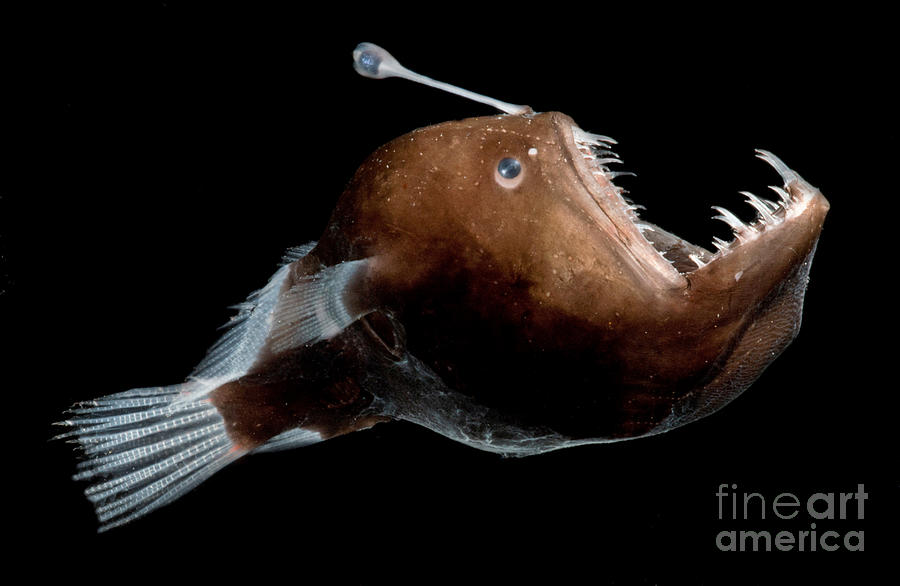
Find the location of a particular element. light is located at coordinates (365, 56).